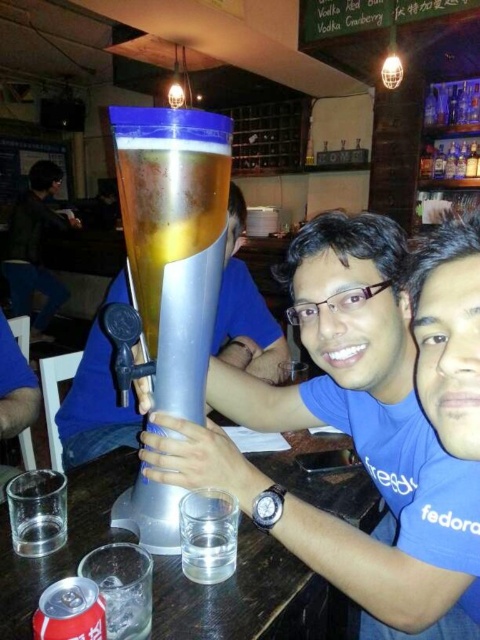
Question: Which object is farther from the camera taking this photo?

Choices:
 (A) matte silver beer tap at center
 (B) silver metallic beer at center
 (C) metallic silver cup at center
 (D) matte black shirt at upper left

Answer: (D)

Question: Which of the following is the farthest from the observer?

Choices:
 (A) matte black shirt at upper left
 (B) matte silver beer tap at center

Answer: (A)

Question: Is metallic silver cup at center below matte black shirt at upper left?

Choices:
 (A) no
 (B) yes

Answer: (B)

Question: Which point is closer to the camera?

Choices:
 (A) (273, 320)
 (B) (196, 316)
 (C) (282, 508)

Answer: (C)

Question: Does silver metallic beer at center lie behind matte black shirt at upper left?

Choices:
 (A) no
 (B) yes

Answer: (A)

Question: Does metallic silver cup at center have a larger size compared to matte black shirt at upper left?

Choices:
 (A) no
 (B) yes

Answer: (A)